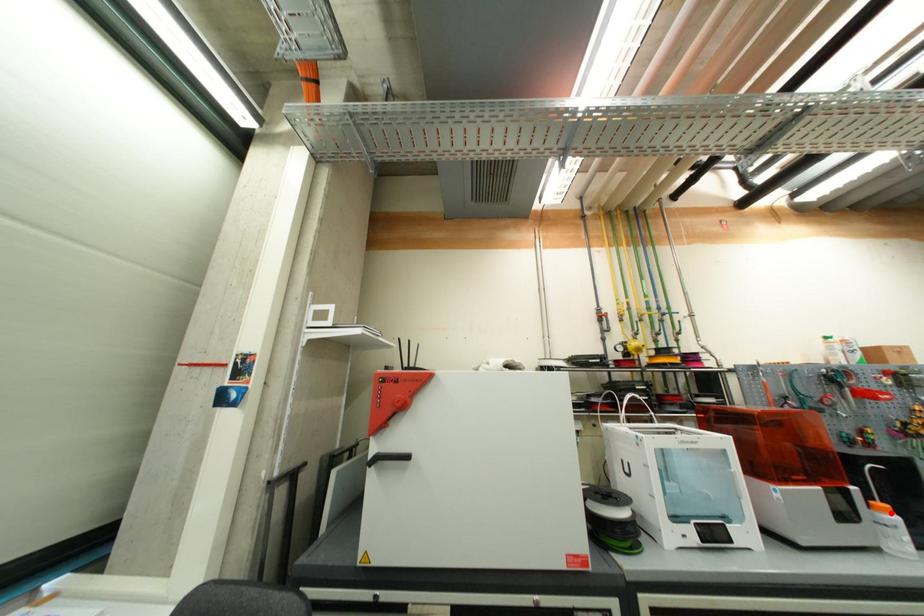
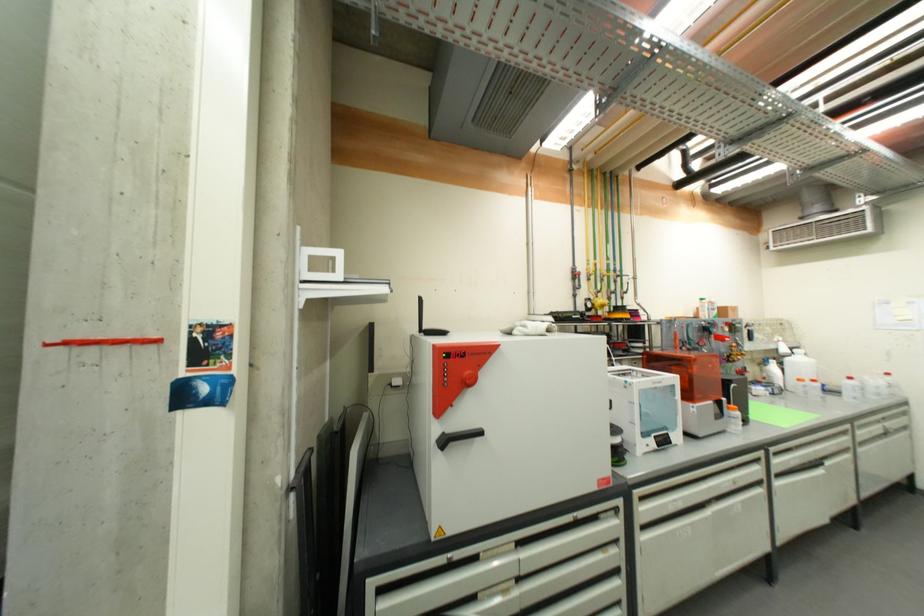
Question: I am providing you with two images of the same scene from different viewpoints. Given a red point in image1, look at the same physical point in image2. Is it:

Choices:
 (A) Closer to the viewpoint
 (B) Farther from the viewpoint

Answer: (B)